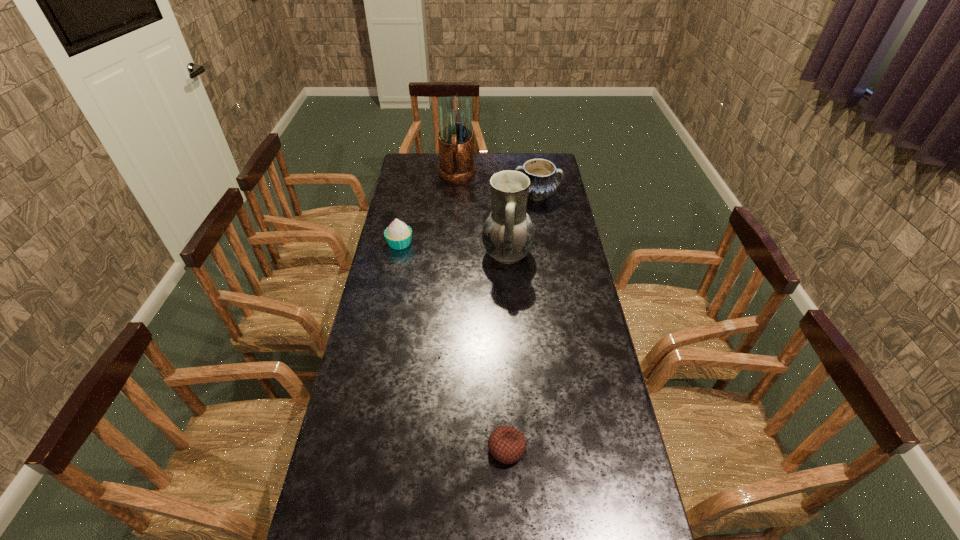
At what (x,y) coordinates should I click in order to perform the action: click on the farther pitcher. Please return your answer as a coordinate pair (x, y). The width and height of the screenshot is (960, 540). Looking at the image, I should click on (455, 137).

Locate an element on the screen. the left pitcher is located at coordinates (455, 137).

At what (x,y) coordinates should I click in order to perform the action: click on the right pitcher. Please return your answer as a coordinate pair (x, y). The height and width of the screenshot is (540, 960). Looking at the image, I should click on (508, 234).

At what (x,y) coordinates should I click in order to perform the action: click on pottery. Please return your answer as a coordinate pair (x, y). Looking at the image, I should click on click(543, 183).

The image size is (960, 540). What are the coordinates of `cupcake` in the screenshot? It's located at (398, 235).

Find the location of a particular element. The height and width of the screenshot is (540, 960). the fourth tallest object is located at coordinates (398, 235).

The image size is (960, 540). I want to click on the shortest object, so [x=506, y=444].

At what (x,y) coordinates should I click in order to perform the action: click on the nearest object. Please return your answer as a coordinate pair (x, y). Looking at the image, I should click on (506, 444).

Identify the location of free region located 0.220m with the handle on the side of the left pitcher. This screenshot has height=540, width=960. (454, 217).

I want to click on free region located on the front-facing side of the right pitcher, so click(x=410, y=254).